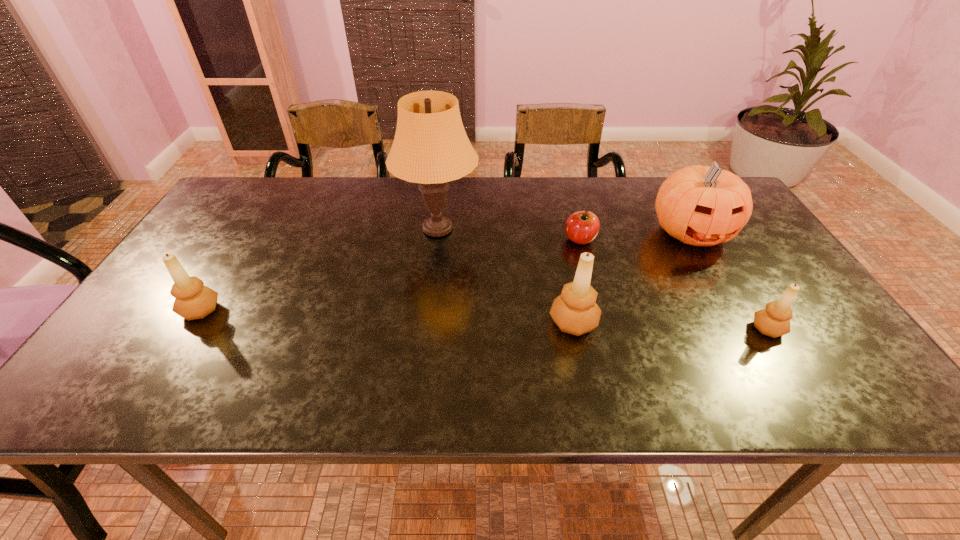
Where is `object present at the far right corner`? The width and height of the screenshot is (960, 540). object present at the far right corner is located at coordinates (699, 205).

This screenshot has width=960, height=540. I want to click on object at the near right corner, so click(x=774, y=321).

Locate an element on the screen. The image size is (960, 540). free space at the far edge is located at coordinates (410, 204).

Where is `vacant space at the near edge of the desktop`? Image resolution: width=960 pixels, height=540 pixels. vacant space at the near edge of the desktop is located at coordinates (463, 364).

The image size is (960, 540). I want to click on blank space at the left edge, so click(171, 329).

Find the location of `vacant area at the far left corner`. vacant area at the far left corner is located at coordinates (242, 213).

This screenshot has height=540, width=960. Identify the location of free space between the pumpkin and the fourth tallest object. (445, 271).

The width and height of the screenshot is (960, 540). I want to click on vacant area that lies between the pumpkin and the lampshade, so click(564, 231).

Where is `unoccupied area between the apple and the tallest object`? Image resolution: width=960 pixels, height=540 pixels. unoccupied area between the apple and the tallest object is located at coordinates (509, 234).

The image size is (960, 540). Identify the location of vacant point located between the pumpkin and the second candle_holder from left to right. (633, 278).